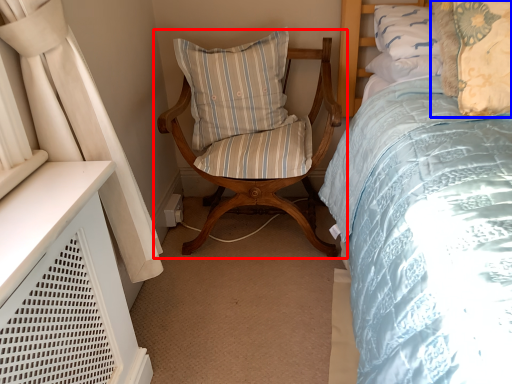
Question: Which object appears closest to the camera in this image, chair (highlighted by a red box) or pillow (highlighted by a blue box)?

Choices:
 (A) chair
 (B) pillow

Answer: (B)